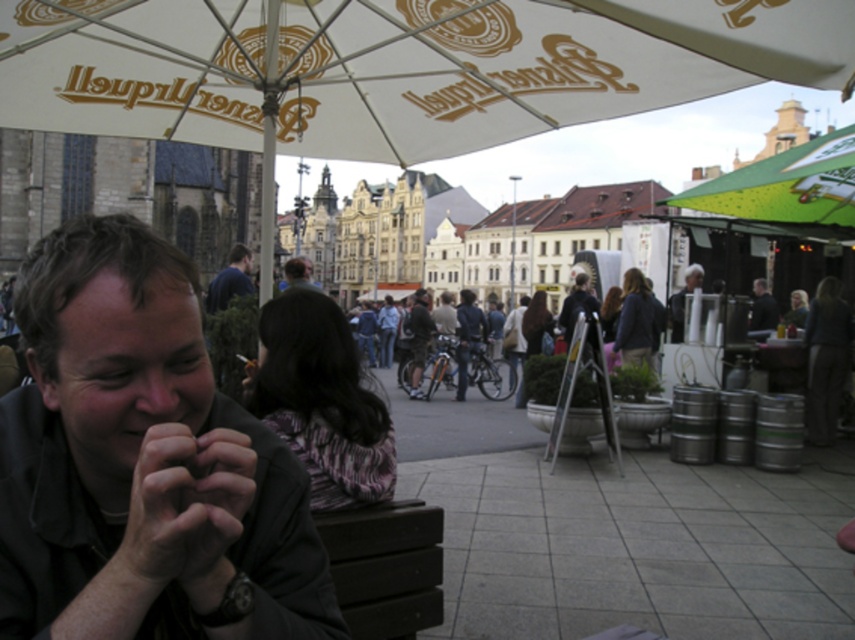
You are a photographer trying to capture the man under the umbrella. The white fabric umbrella at upper center and the dark skin hand at center are both in your view. Which object is positioned higher in the image?

The white fabric umbrella at upper center is located above the dark skin hand at center, so it is positioned higher in the image.

Consider the image. You are standing at the viewpoint of the image and want to reach the point marked at coordinates point [739,42]. If you walk directly towards it, how far will you have to walk?

→ The point marked at coordinates point [739,42] is 49.11 meters away from the viewer, so you will have to walk 49.11 meters to reach it.

Consider the image. You are a photographer standing at the base of the Svety Piv umbrella. You want to take a photo of both the blue shirt at center and the gray fabric jacket at upper right. The camera you are using has a maximum zoom range of 150 feet. Can you capture both subjects in a single frame without moving the camera?

The blue shirt at center is 161.43 feet from the gray fabric jacket at upper right. Since the camera has a maximum zoom range of 150 feet, the distance between them exceeds the camera capabilities. Therefore, you cannot capture both subjects in a single frame without moving the camera.